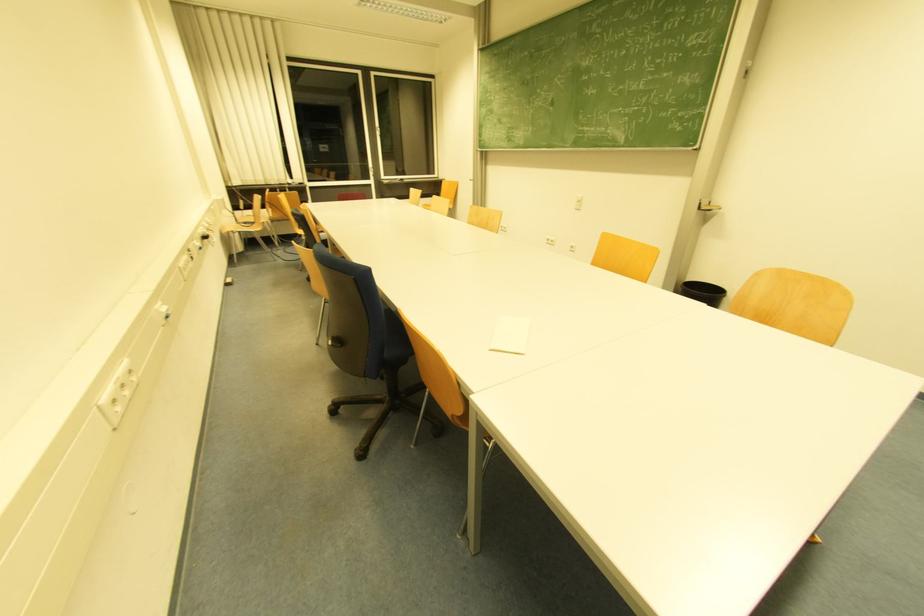
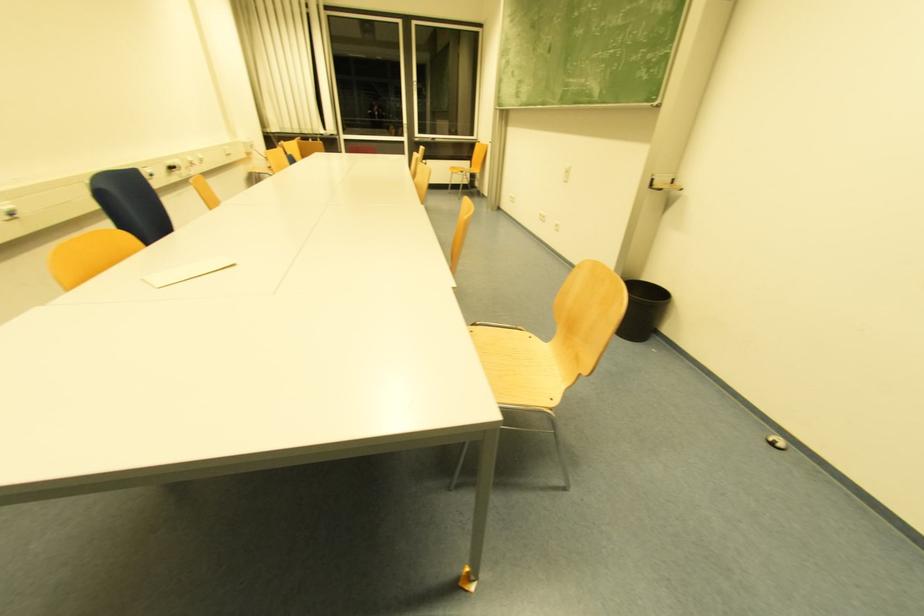
Question: Which direction would the cameraman need to move to produce the second image? Reply with the corresponding letter.

Choices:
 (A) Left
 (B) Right
 (C) Forward
 (D) Backward

Answer: (B)